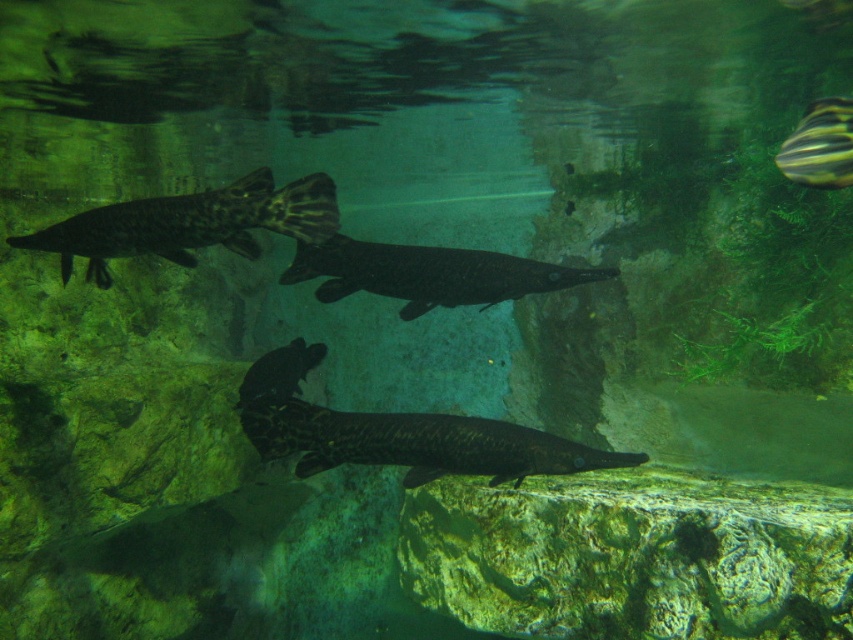
Question: Is dark gray matte fish at center smaller than shiny black fish at center?

Choices:
 (A) yes
 (B) no

Answer: (B)

Question: Which point is closer to the camera taking this photo?

Choices:
 (A) (190, 227)
 (B) (399, 264)

Answer: (A)

Question: Among these objects, which one is farthest from the camera?

Choices:
 (A) dark spotted fish at center
 (B) shiny black fish at center
 (C) dark brown textured fish at upper left

Answer: (B)

Question: Is dark brown textured fish at upper left smaller than dark gray matte fish at center?

Choices:
 (A) yes
 (B) no

Answer: (B)

Question: Among these points, which one is farthest from the camera?

Choices:
 (A) (172, 236)
 (B) (312, 445)
 (C) (285, 372)
 (D) (807, 150)

Answer: (C)

Question: Is striped yellow-black fish at upper right to the left of shiny black fish at center from the viewer's perspective?

Choices:
 (A) yes
 (B) no

Answer: (B)